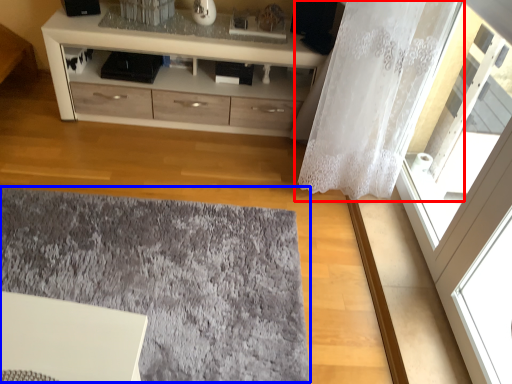
Question: Among these objects, which one is farthest to the camera, curtain (highlighted by a red box) or mat (highlighted by a blue box)?

Choices:
 (A) curtain
 (B) mat

Answer: (A)